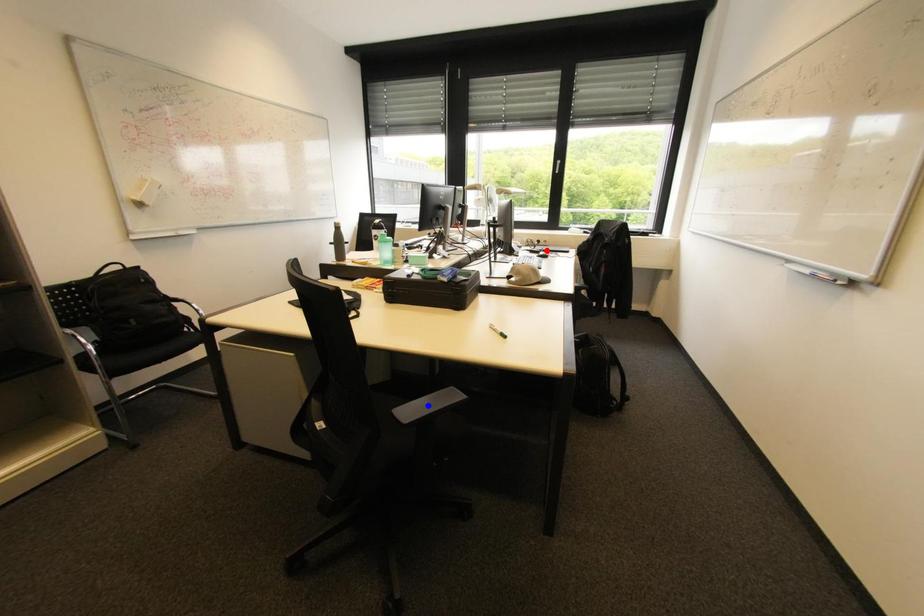
Question: Two points are marked on the image. Which point is closer to the camera?

Choices:
 (A) Blue point is closer.
 (B) Red point is closer.

Answer: (A)